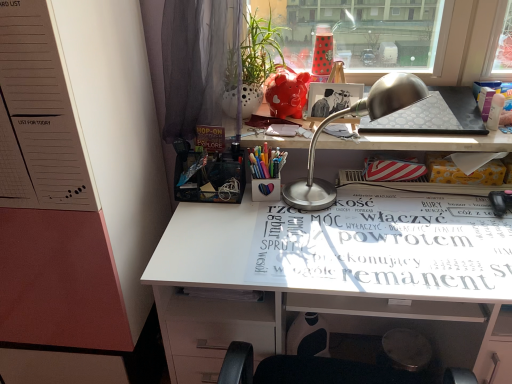
Where is `free space that is to the left of silver metallic desk lamp at upper center`? This screenshot has width=512, height=384. free space that is to the left of silver metallic desk lamp at upper center is located at coordinates pos(226,236).